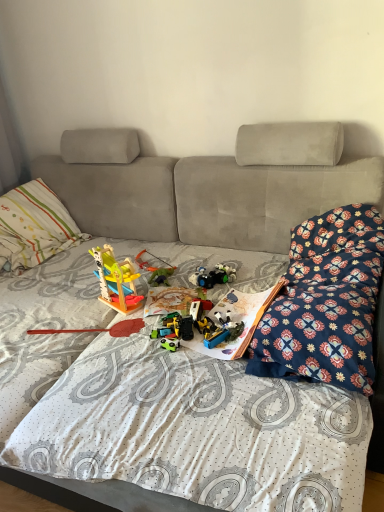
Question: Can you confirm if wooden toy at center, which is counted as the 2th toy, starting from the front, is wider than plastic green toy at center, which is counted as the second toy, starting from the back?

Choices:
 (A) no
 (B) yes

Answer: (A)

Question: From the image's perspective, would you say wooden toy at center, which is counted as the 4th toy, starting from the back, is positioned over plastic green toy at center, which is counted as the second toy, starting from the back?

Choices:
 (A) yes
 (B) no

Answer: (A)

Question: Does wooden toy at center, which is counted as the 2th toy, starting from the front, appear on the left side of plastic green toy at center, marked as the 4th toy in a front-to-back arrangement?

Choices:
 (A) no
 (B) yes

Answer: (B)

Question: Does wooden toy at center, which is counted as the 2th toy, starting from the front, touch plastic green toy at center, marked as the 4th toy in a front-to-back arrangement?

Choices:
 (A) no
 (B) yes

Answer: (A)

Question: Considering the relative sizes of wooden toy at center, which is counted as the 2th toy, starting from the front, and plastic green toy at center, which is counted as the second toy, starting from the back, in the image provided, is wooden toy at center, which is counted as the 2th toy, starting from the front, smaller than plastic green toy at center, which is counted as the second toy, starting from the back,?

Choices:
 (A) yes
 (B) no

Answer: (B)

Question: Is wooden toy at center, which is counted as the 4th toy, starting from the back, oriented away from plastic green toy at center, marked as the 4th toy in a front-to-back arrangement?

Choices:
 (A) yes
 (B) no

Answer: (A)

Question: Considering the relative sizes of multicolored plastic toy at center, the third toy when ordered from front to back, and green plastic toy at center, the fifth toy positioned from the back, in the image provided, is multicolored plastic toy at center, the third toy when ordered from front to back, taller than green plastic toy at center, the fifth toy positioned from the back,?

Choices:
 (A) no
 (B) yes

Answer: (B)

Question: From the image's perspective, does multicolored plastic toy at center, marked as the 3th toy in a back-to-front arrangement, appear lower than green plastic toy at center, which ranks as the 1th toy in front-to-back order?

Choices:
 (A) no
 (B) yes

Answer: (A)

Question: Is multicolored plastic toy at center, marked as the 3th toy in a back-to-front arrangement, positioned in front of green plastic toy at center, which ranks as the 1th toy in front-to-back order?

Choices:
 (A) yes
 (B) no

Answer: (B)

Question: Is multicolored plastic toy at center, marked as the 3th toy in a back-to-front arrangement, positioned with its back to green plastic toy at center, the fifth toy positioned from the back?

Choices:
 (A) yes
 (B) no

Answer: (B)

Question: Does multicolored plastic toy at center, the third toy when ordered from front to back, have a lesser height compared to green plastic toy at center, which ranks as the 1th toy in front-to-back order?

Choices:
 (A) yes
 (B) no

Answer: (B)

Question: Can you confirm if multicolored plastic toy at center, the third toy when ordered from front to back, is thinner than green plastic toy at center, which ranks as the 1th toy in front-to-back order?

Choices:
 (A) yes
 (B) no

Answer: (B)

Question: Is the position of paperboard book at center more distant than that of floral-patterned fabric at right?

Choices:
 (A) yes
 (B) no

Answer: (A)